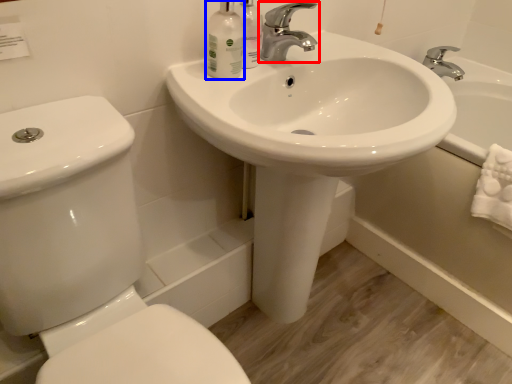
Question: Which object is closer to the camera taking this photo, tap (highlighted by a red box) or mouthwash (highlighted by a blue box)?

Choices:
 (A) tap
 (B) mouthwash

Answer: (B)